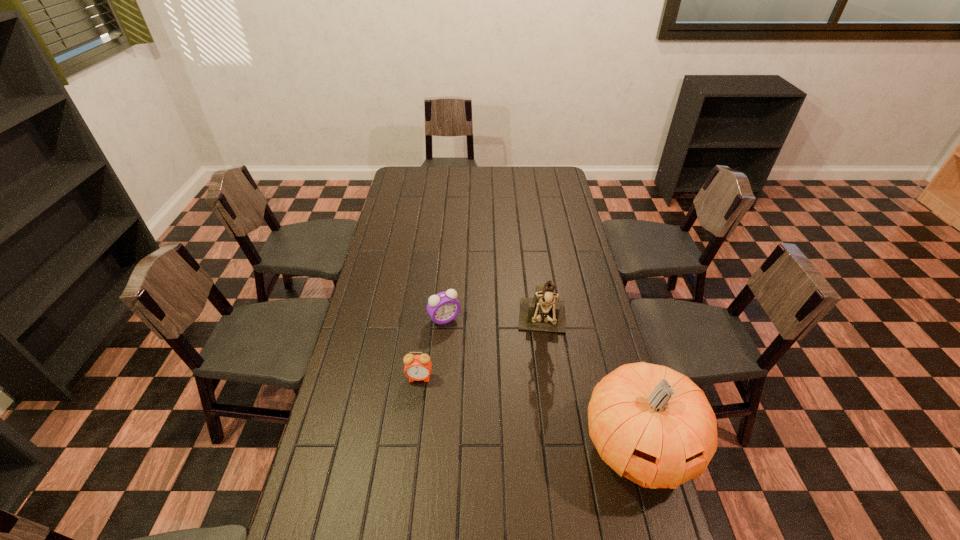
Find the location of a particular element. This screenshot has height=540, width=960. free space at the near right corner of the desktop is located at coordinates (660, 522).

Find the location of `vacant space that's between the farther alarm clock and the pumpkin`. vacant space that's between the farther alarm clock and the pumpkin is located at coordinates (541, 382).

Locate an element on the screen. vacant space in between the figurine and the pumpkin is located at coordinates (590, 386).

Locate an element on the screen. vacant area that lies between the figurine and the second nearest object is located at coordinates (482, 352).

Image resolution: width=960 pixels, height=540 pixels. I want to click on empty location between the nearest object and the farther alarm clock, so coord(541,382).

The width and height of the screenshot is (960, 540). I want to click on free space between the figurine and the nearest object, so click(590, 386).

Image resolution: width=960 pixels, height=540 pixels. I want to click on vacant area that lies between the figurine and the farther alarm clock, so click(x=494, y=322).

You are a GUI agent. You are given a task and a screenshot of the screen. Output one action in this format:
    pyautogui.click(x=<x>, y=<y>)
    Task: Click on the vacant space that's between the figurine and the farther alarm clock
    The height and width of the screenshot is (540, 960).
    Given the screenshot: What is the action you would take?
    pyautogui.click(x=494, y=322)

Locate an element on the screen. free space between the nearest object and the nearer alarm clock is located at coordinates [529, 412].

This screenshot has width=960, height=540. Identify the location of free space between the pumpkin and the farther alarm clock. (541, 382).